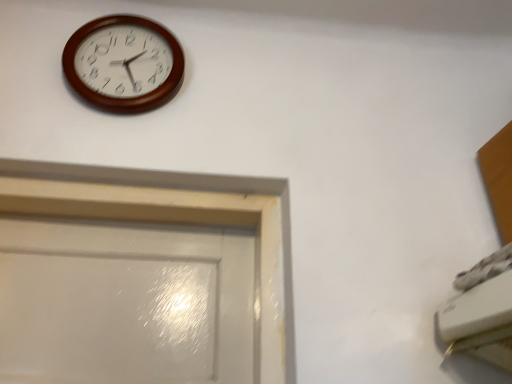
What do you see at coordinates (124, 64) in the screenshot?
I see `wooden clock at upper center` at bounding box center [124, 64].

This screenshot has width=512, height=384. In order to click on wooden clock at upper center in this screenshot , I will do `click(124, 64)`.

Measure the distance between point (175, 59) and camera.

Point (175, 59) and camera are 1.12 meters apart.

Where is `wooden clock at upper center`? wooden clock at upper center is located at coordinates (124, 64).